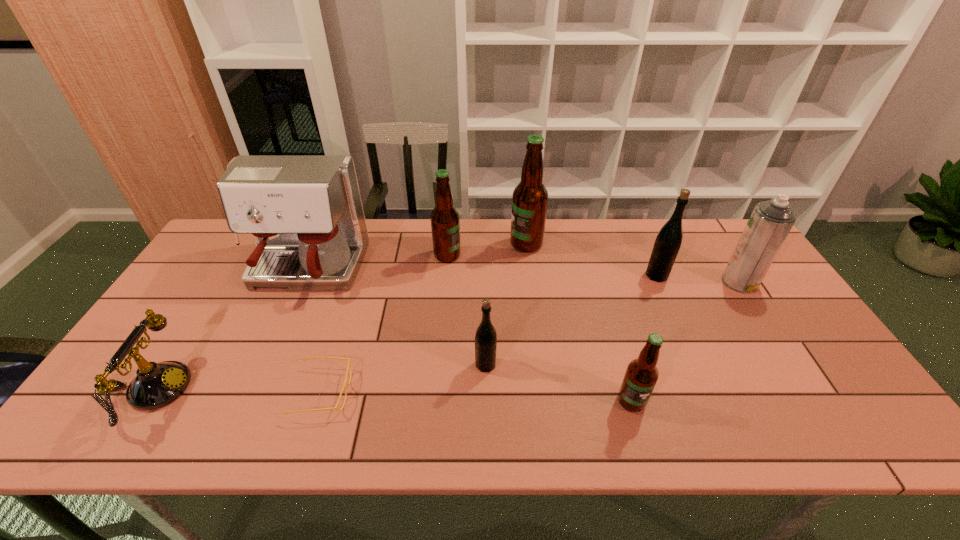
Locate an element on the screen. vacant area between the nearest brown beer bottle and the second smallest brown beer bottle is located at coordinates (x=540, y=328).

The image size is (960, 540). Find the location of `object that is the fifth closest to the third beer bottle from left to right`. object that is the fifth closest to the third beer bottle from left to right is located at coordinates (641, 375).

Locate which object is the third closest to the second object from right to left. Please provide its 2D coordinates. Your answer should be formatted as a tuple, i.e. [(x, y)], where the tuple contains the x and y coordinates of a point satisfying the conditions above.

[(641, 375)]

Choose which beer bottle is the second nearest neighbor to the shortest object. Please provide its 2D coordinates. Your answer should be formatted as a tuple, i.e. [(x, y)], where the tuple contains the x and y coordinates of a point satisfying the conditions above.

[(445, 223)]

This screenshot has height=540, width=960. Find the location of `the closest beer bottle to the black telephone`. the closest beer bottle to the black telephone is located at coordinates (445, 223).

Find the location of a particular element. The height and width of the screenshot is (540, 960). the closest brown beer bottle to the tallest beer bottle is located at coordinates (445, 223).

The image size is (960, 540). I want to click on brown beer bottle that is the second closest to the rightmost object, so [530, 197].

You are a GUI agent. You are given a task and a screenshot of the screen. Output one action in this format:
    pyautogui.click(x=<x>, y=<y>)
    Task: Click on the vacant point that satisfies the following two spatial constraints: 1. on the label of the leftmost beer bottle; 2. on the back side of the second nearest beer bottle
    
    Given the screenshot: What is the action you would take?
    pyautogui.click(x=438, y=364)

I want to click on free space that satisfies the following two spatial constraints: 1. on the front of the third farthest beer bottle near the spout; 2. on the right side of the red coffee maker, so click(303, 275).

The image size is (960, 540). Find the location of `free space that satisfies the following two spatial constraints: 1. on the front of the bigger green beer bottle near the spout; 2. on the left side of the coffee maker`. free space that satisfies the following two spatial constraints: 1. on the front of the bigger green beer bottle near the spout; 2. on the left side of the coffee maker is located at coordinates (303, 275).